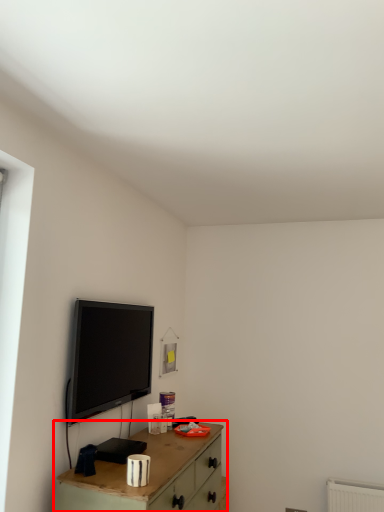
Question: From the image's perspective, what is the correct spatial relationship of table (annotated by the red box) in relation to television?

Choices:
 (A) above
 (B) below

Answer: (B)